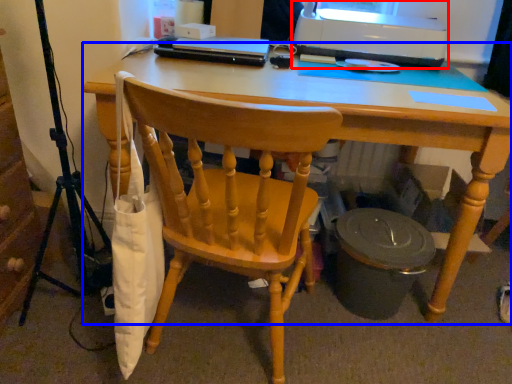
Question: Which object appears closest to the camera in this image, printer (highlighted by a red box) or desk (highlighted by a blue box)?

Choices:
 (A) printer
 (B) desk

Answer: (B)